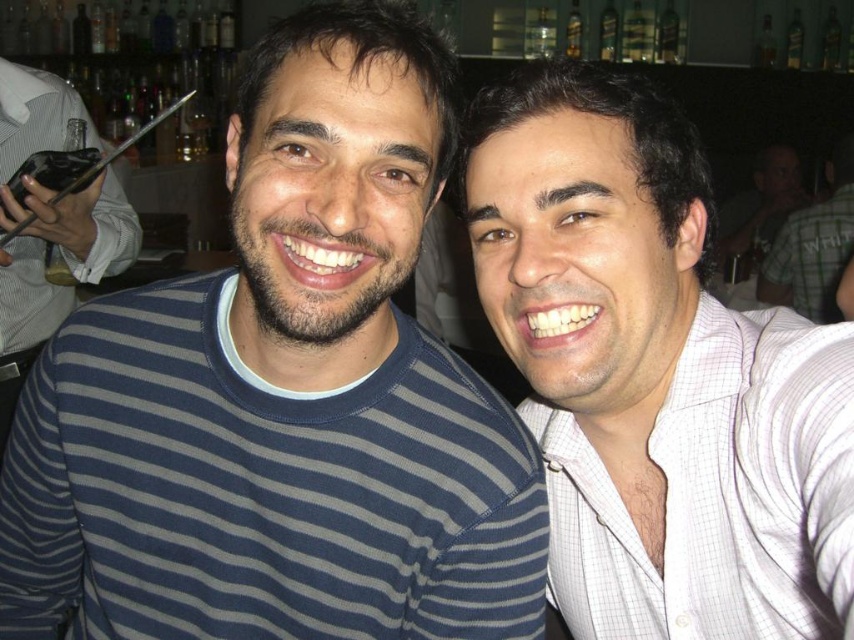
Question: Is matte black phone at left smaller than black glossy phone at upper left?

Choices:
 (A) no
 (B) yes

Answer: (A)

Question: Among these objects, which one is farthest from the camera?

Choices:
 (A) black glossy phone at upper left
 (B) blue striped sweater at center

Answer: (A)

Question: Can you confirm if blue striped sweater at center is positioned above white checkered shirt at upper right?

Choices:
 (A) yes
 (B) no

Answer: (B)

Question: Can you confirm if matte black phone at left is smaller than black glossy phone at upper left?

Choices:
 (A) yes
 (B) no

Answer: (B)

Question: Which is nearer to the white checkered shirt at upper right?

Choices:
 (A) matte black phone at left
 (B) black glossy phone at upper left
 (C) white checkered shirt at right
 (D) blue striped sweater at center

Answer: (C)

Question: Which point is farther to the camera?

Choices:
 (A) matte black phone at left
 (B) black glossy phone at upper left

Answer: (B)